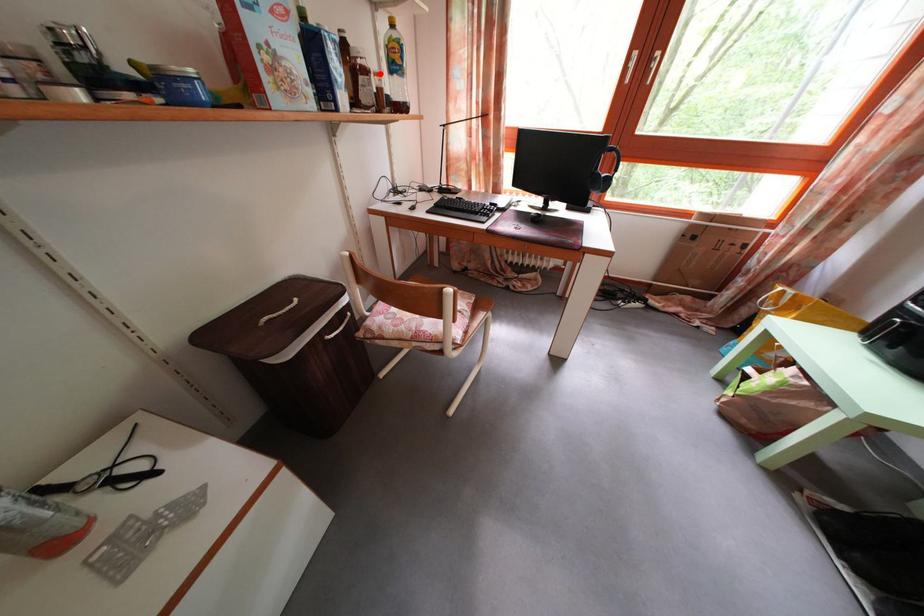
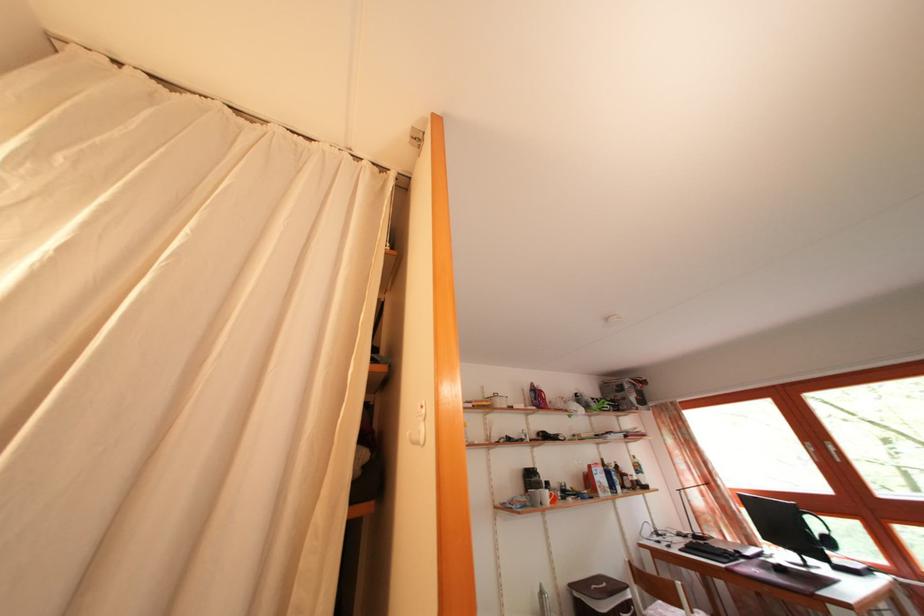
In the second image, find the point that corresponds to the highlighted location in the first image.

(636, 480)